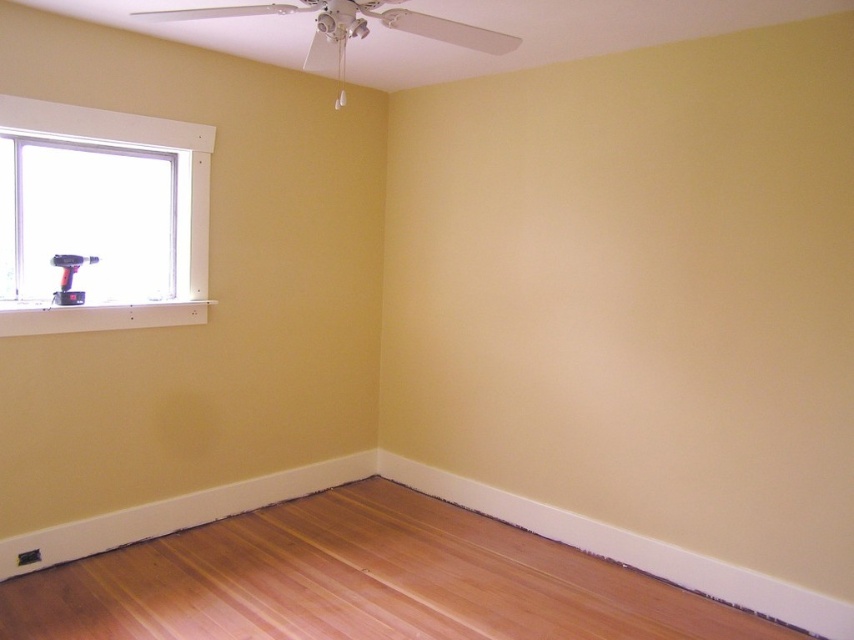
You are standing in the room and want to reach both the white plastic window at left and the matte black drill at window. Which object is closer to you?

The white plastic window at left is closer to the viewer than the matte black drill at window, so the window is closer.

Based on the photo, you are standing in the room and want to place a heavy object on the floor near the window. Is the natural wood flooring at lower center directly below the matte black drill at window?

The natural wood flooring at lower center is positioned under the matte black drill at window, so yes, placing the heavy object there would be directly below the drill.